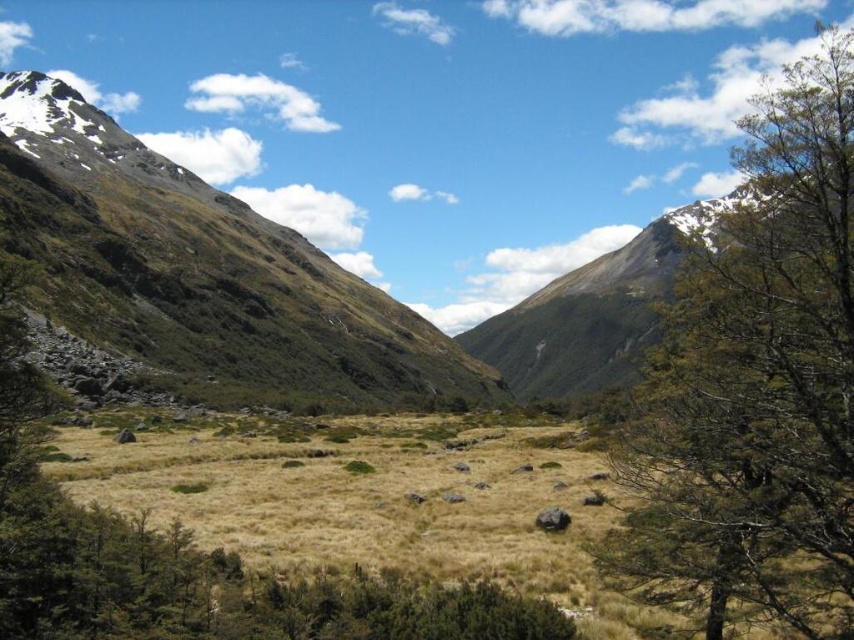
You are a hiker planning to cross the valley. You notice the green leafy tree at right and the green grassy mountain at center. Which object is wider when viewed from above?

The green leafy tree at right is wider than the green grassy mountain at center because its width surpasses the mountain.

You are standing at the center of the valley and want to reach the green leafy tree at right. Which direction should you walk to get there?

You should walk to the right to reach the green leafy tree at right because it is located at the right side of the valley.

You are standing in the valley looking up at the mountains. Which mountain is positioned to the left when viewing the brown rocky mountain at center and the green grassy mountain at center?

The brown rocky mountain at center is positioned to the left of the green grassy mountain at center.